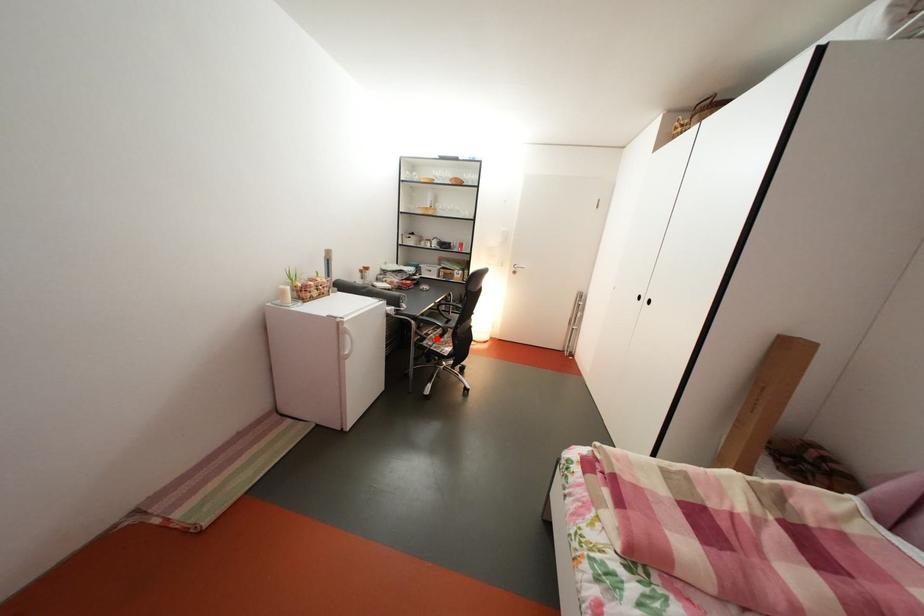
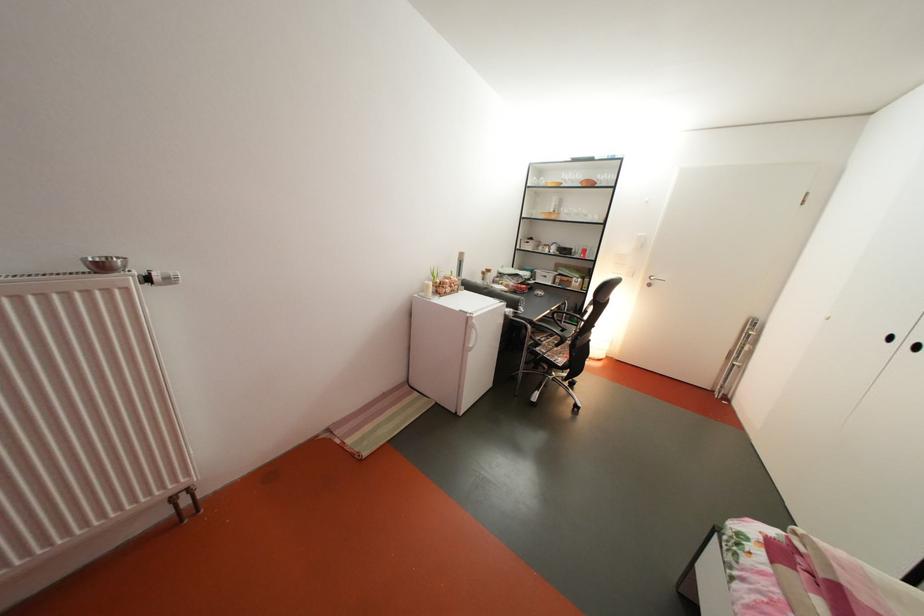
Question: I am providing you with two images of the same scene from different viewpoints. Image1 has a red point marked. In image2, the corresponding 3D location appears at what relative position? Reply with the corresponding letter.

Choices:
 (A) Closer
 (B) Farther

Answer: (A)